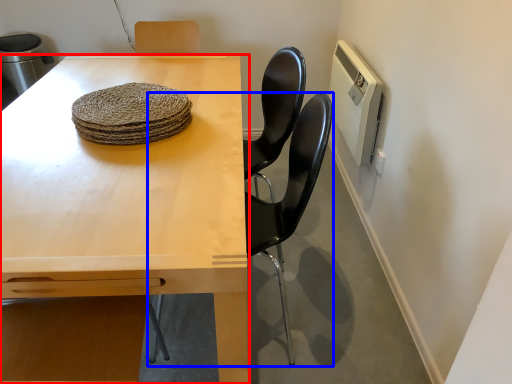
Question: Which point is further to the camera, table (highlighted by a red box) or chair (highlighted by a blue box)?

Choices:
 (A) table
 (B) chair

Answer: (B)